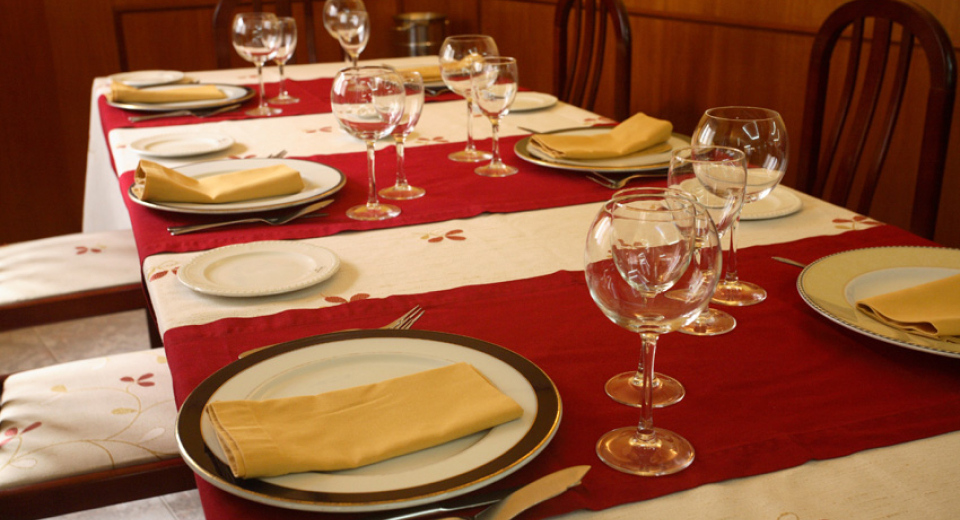
At what (x,y) coordinates should I click in order to perform the action: click on yellow napkins. Please return your answer as a coordinate pair (x, y). This screenshot has height=520, width=960. Looking at the image, I should click on (357, 434), (237, 188), (185, 92), (428, 73), (589, 145), (900, 318).